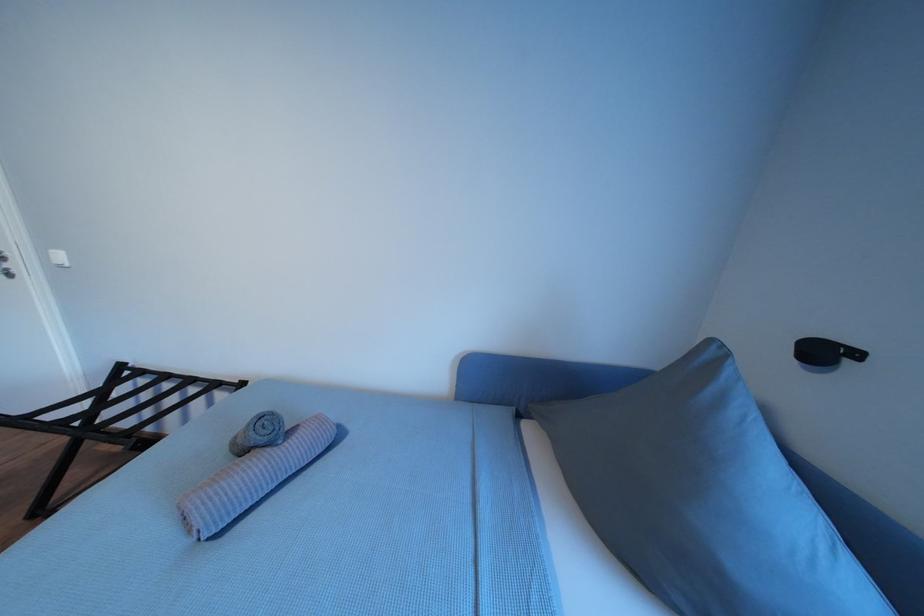
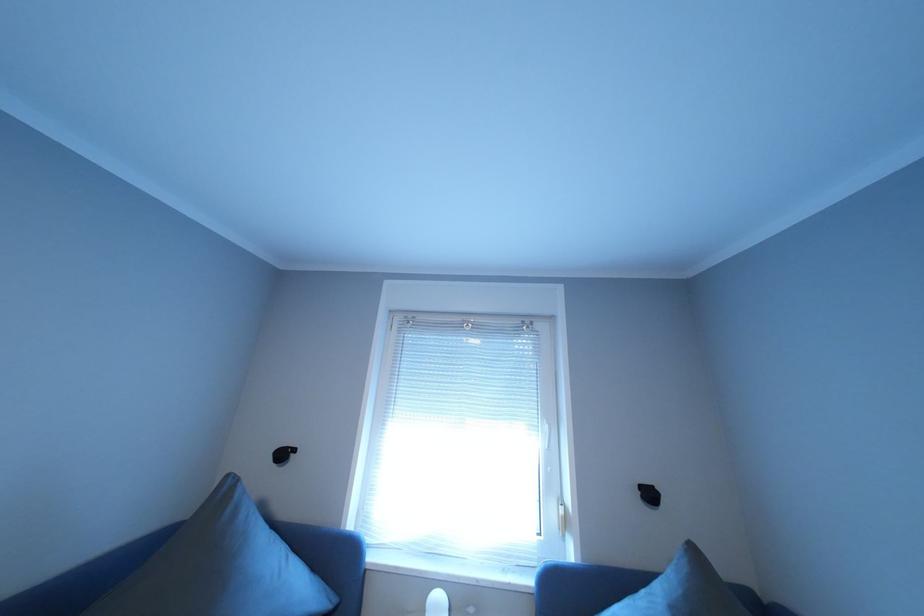
Question: How did the camera likely rotate?

Choices:
 (A) Left
 (B) Right
 (C) Up
 (D) Down

Answer: (B)